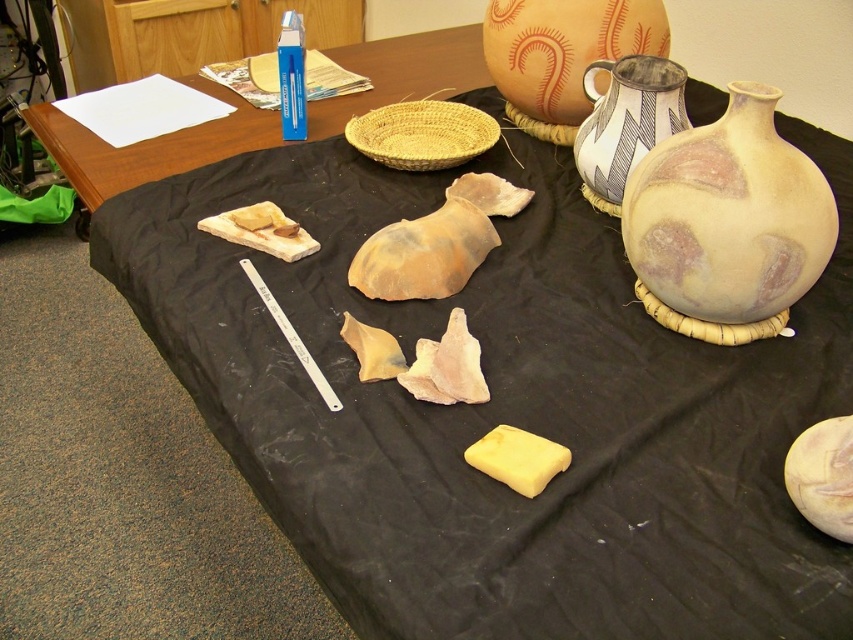
Question: Is matte clay vase at right thinner than yellow rubber at center?

Choices:
 (A) yes
 (B) no

Answer: (B)

Question: Observing the image, what is the correct spatial positioning of wooden table at upper left in reference to speckled clay vase at upper right?

Choices:
 (A) below
 (B) above

Answer: (B)

Question: Which point is closer to the camera taking this photo?

Choices:
 (A) (175, 132)
 (B) (538, 488)

Answer: (B)

Question: Which is nearer to the wooden table at upper left?

Choices:
 (A) matte clay vase at right
 (B) speckled clay vase at upper right
 (C) yellow rubber at center

Answer: (B)

Question: Is wooden table at upper left bigger than speckled clay vase at upper right?

Choices:
 (A) no
 (B) yes

Answer: (B)

Question: Among these points, which one is farthest from the camera?

Choices:
 (A) (514, 472)
 (B) (689, 225)
 (C) (474, 80)

Answer: (C)